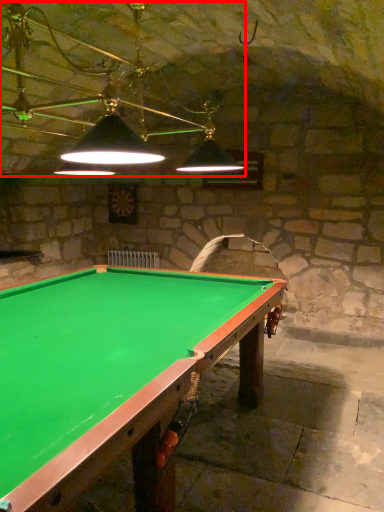
Question: From the image's perspective, where is lamp (annotated by the red box) located relative to billiard table?

Choices:
 (A) above
 (B) below

Answer: (A)